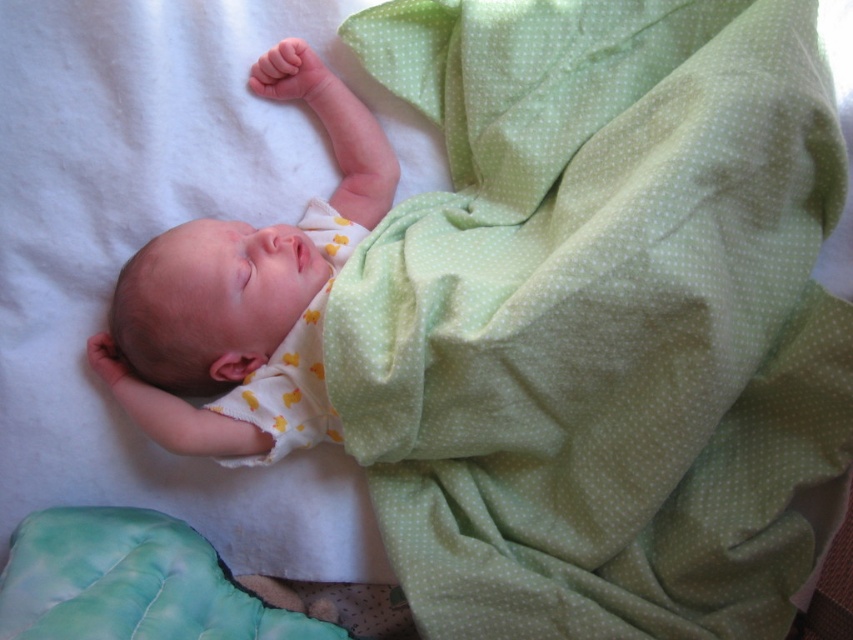
Question: Is soft yellow fabric at center to the left of yellow dotted fabric at center from the viewer's perspective?

Choices:
 (A) no
 (B) yes

Answer: (B)

Question: Is soft yellow fabric at center thinner than yellow dotted fabric at center?

Choices:
 (A) yes
 (B) no

Answer: (B)

Question: Among these points, which one is farthest from the camera?

Choices:
 (A) (254, 296)
 (B) (340, 266)

Answer: (B)

Question: Which of the following is the closest to the observer?

Choices:
 (A) (231, 310)
 (B) (303, 230)

Answer: (A)

Question: Where is soft yellow fabric at center located in relation to yellow dotted fabric at center in the image?

Choices:
 (A) right
 (B) left

Answer: (B)